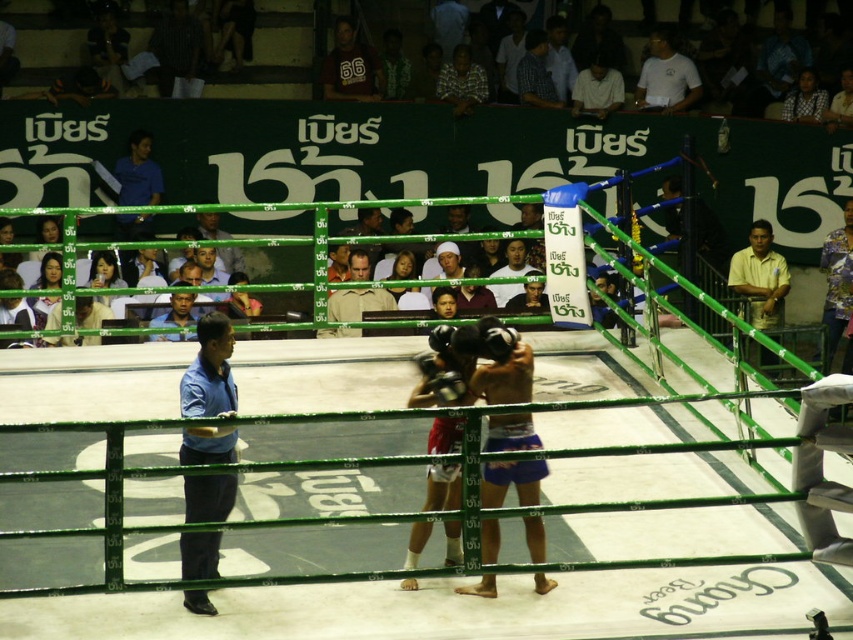
In the scene shown: Can you confirm if blue shirt at left is bigger than yellow matte shirt at right?

No, blue shirt at left is not bigger than yellow matte shirt at right.

Does point (196, 550) come behind point (753, 266)?

No, (196, 550) is in front of (753, 266).

This screenshot has width=853, height=640. Find the location of `blue shirt at left`. blue shirt at left is located at coordinates (209, 371).

From the picture: Does light brown shirt at center appear on the right side of checkered fabric shirt at upper center?

In fact, light brown shirt at center is to the left of checkered fabric shirt at upper center.

Is light brown shirt at center taller than checkered fabric shirt at upper center?

No, light brown shirt at center is not taller than checkered fabric shirt at upper center.

Between point (347, 307) and point (550, 83), which one is positioned in front?

Positioned in front is point (347, 307).

This screenshot has height=640, width=853. I want to click on light brown shirt at center, so click(357, 301).

Between blue shirt at left and light brown wooden chair at upper center, which one has more height?

blue shirt at left is taller.

Is point (202, 348) farther from camera compared to point (782, 106)?

No, (202, 348) is in front of (782, 106).

Locate an element on the screen. Image resolution: width=853 pixels, height=640 pixels. blue shirt at left is located at coordinates (209, 371).